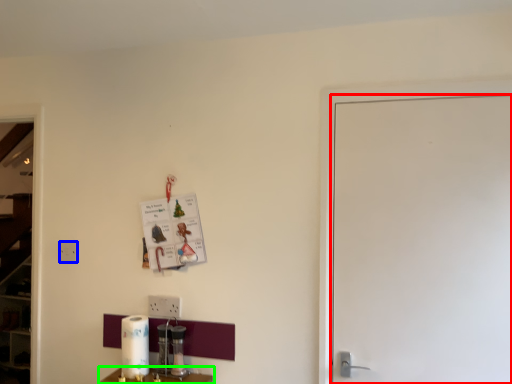
Question: Considering the real-world distances, which object is closest to door (highlighted by a red box)? electric outlet (highlighted by a blue box) or furniture (highlighted by a green box).

Choices:
 (A) electric outlet
 (B) furniture

Answer: (B)